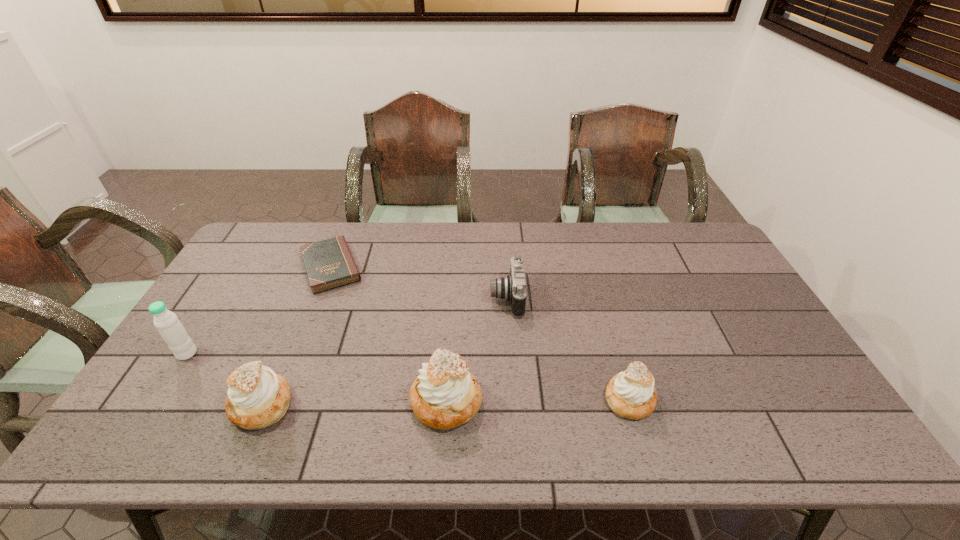
Locate an element on the screen. This screenshot has height=540, width=960. vacant space located 0.390m on the left of the rightmost pastry is located at coordinates (445, 399).

Identify the location of vacant region located on the left of the shortest object. The height and width of the screenshot is (540, 960). (269, 267).

You are a GUI agent. You are given a task and a screenshot of the screen. Output one action in this format:
    pyautogui.click(x=<x>, y=<y>)
    Task: Click on the vacant area situated 0.330m on the front-facing side of the camera
    This screenshot has width=960, height=540.
    Given the screenshot: What is the action you would take?
    pyautogui.click(x=383, y=298)

This screenshot has height=540, width=960. Find the location of `vacant space located 0.230m on the front-facing side of the camera`. vacant space located 0.230m on the front-facing side of the camera is located at coordinates (416, 298).

At what (x,y) coordinates should I click in order to perform the action: click on vacant space located 0.050m on the front-facing side of the camera. Please return your answer as a coordinate pair (x, y). The width and height of the screenshot is (960, 540). Looking at the image, I should click on (474, 298).

The width and height of the screenshot is (960, 540). What are the coordinates of `vacant point located 0.390m on the right of the third farthest object` in the screenshot? It's located at (342, 354).

The height and width of the screenshot is (540, 960). I want to click on object that is at the far edge, so click(x=329, y=264).

What are the coordinates of `object that is at the left edge` in the screenshot? It's located at (170, 328).

Image resolution: width=960 pixels, height=540 pixels. I want to click on free region at the far edge of the desktop, so click(x=544, y=228).

At what (x,y) coordinates should I click in order to perform the action: click on vacant space at the near edge of the desktop. Please return your answer as a coordinate pair (x, y). Looking at the image, I should click on (565, 387).